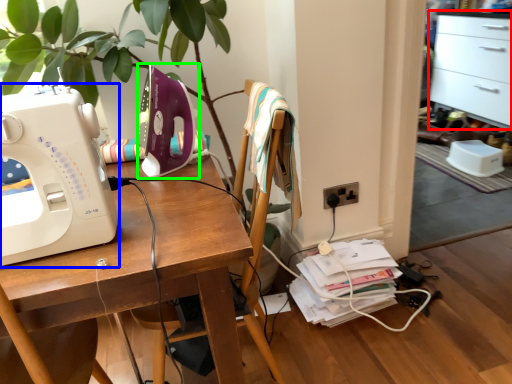
Question: Which is farther away from file cabinet (highlighted by a red box)? sewing machine (highlighted by a blue box) or sewing machine (highlighted by a green box)?

Choices:
 (A) sewing machine
 (B) sewing machine

Answer: (A)